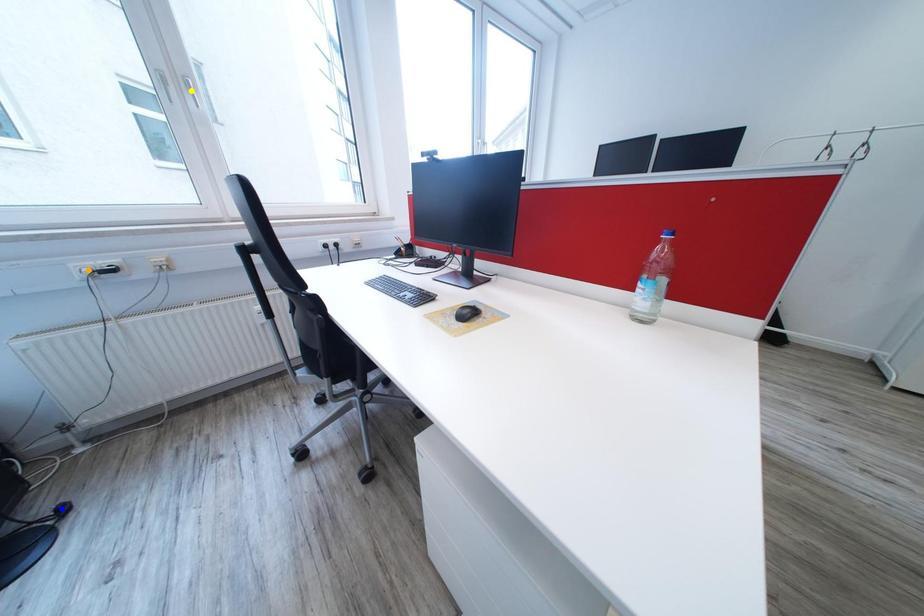
Order these from farthest to nearest:
blue point | orange point | yellow point

1. yellow point
2. orange point
3. blue point